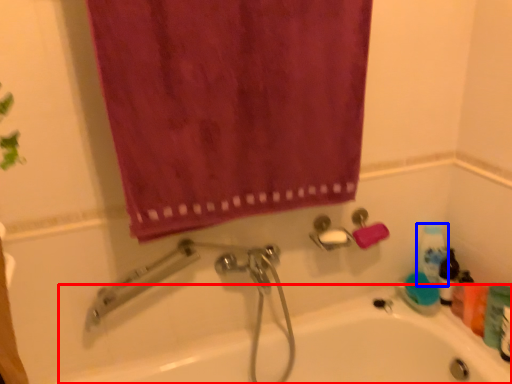
Question: Which of the following is the closest to the observer, bath (highlighted by a red box) or cleaning product (highlighted by a blue box)?

Choices:
 (A) bath
 (B) cleaning product

Answer: (A)